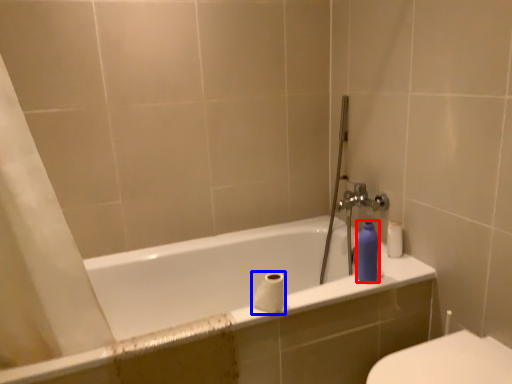
Question: Among these objects, which one is farthest to the camera, toiletry (highlighted by a red box) or toilet paper (highlighted by a blue box)?

Choices:
 (A) toiletry
 (B) toilet paper

Answer: (A)